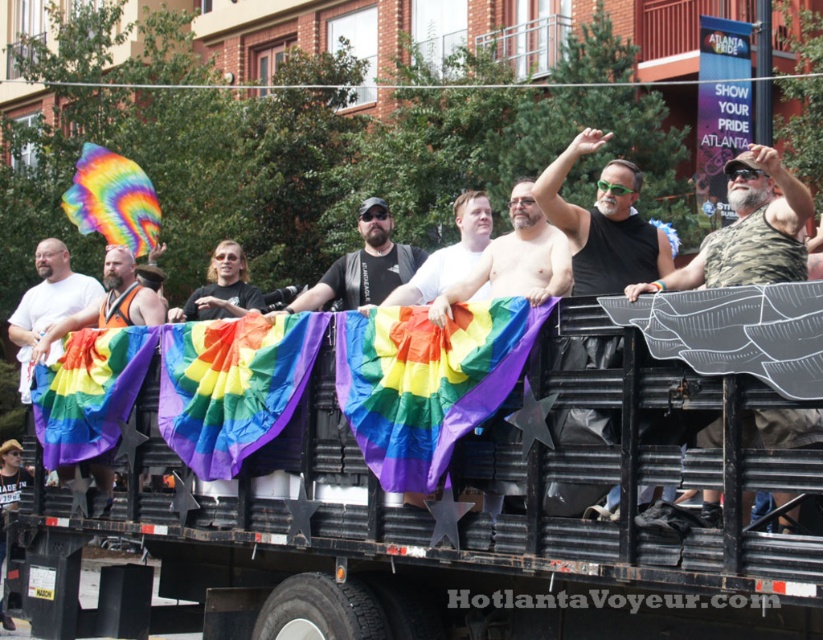
Which of these two, camouflage tank top at center or matte black tank top at center, stands taller?

camouflage tank top at center

Measure the distance from camouflage tank top at center to matte black tank top at center.

7.05 meters

The image size is (823, 640). What do you see at coordinates (749, 230) in the screenshot?
I see `camouflage tank top at center` at bounding box center [749, 230].

This screenshot has width=823, height=640. Find the location of `camouflage tank top at center`. camouflage tank top at center is located at coordinates (749, 230).

How far apart are shiny silver tank top at center and matte black tank top at center?

shiny silver tank top at center and matte black tank top at center are 3.84 meters apart.

Can you confirm if shiny silver tank top at center is positioned to the left of matte black tank top at center?

In fact, shiny silver tank top at center is to the right of matte black tank top at center.

Which is behind, point (531, 212) or point (326, 275)?

The point (326, 275) is behind.

Identify the location of shiny silver tank top at center. (515, 260).

Which of these two, shiny silver tank top at center or matte white shirt at center, stands shorter?

With less height is matte white shirt at center.

Who is more distant from viewer, (482, 275) or (470, 237)?

Point (470, 237)

The width and height of the screenshot is (823, 640). Identify the location of shiny silver tank top at center. (515, 260).